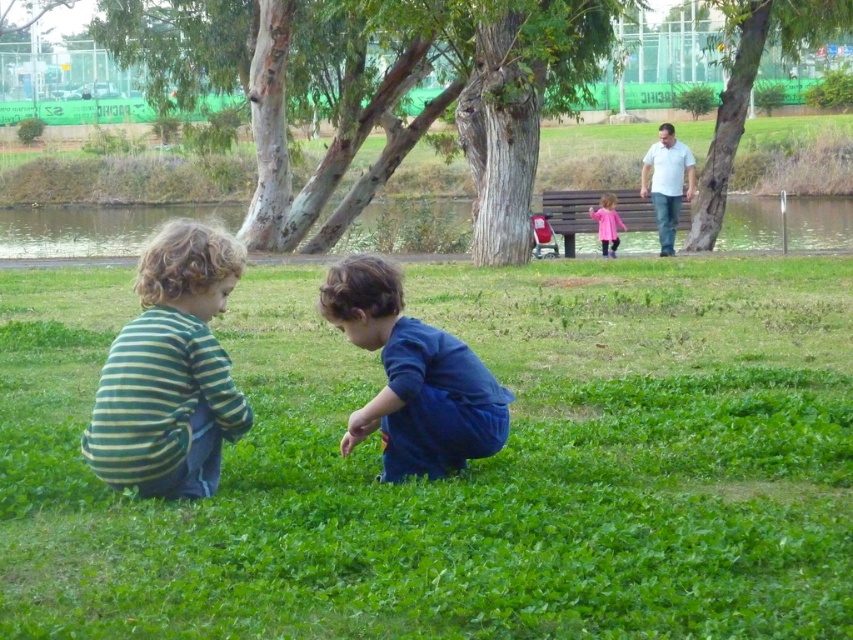
You are a photographer planning to take a portrait of the two subjects wearing the white cotton shirt at upper right and the pink fabric dress at center. Which clothing item should you place closer to the camera to maintain their relative sizes in the photo?

To maintain their relative sizes, the white cotton shirt at upper right should be placed closer to the camera since it is larger than the pink fabric dress at center, ensuring they appear proportionally sized in the photograph.